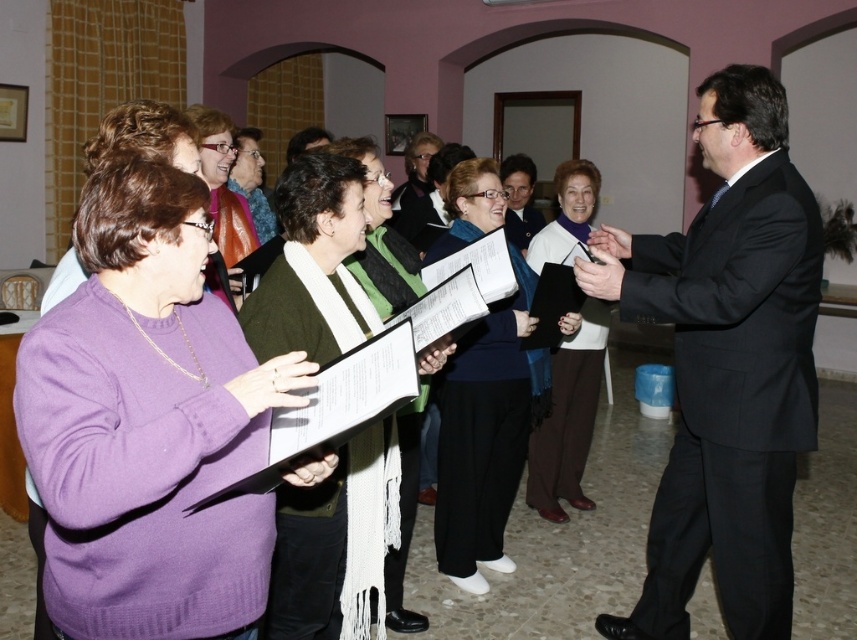
Question: From the image, what is the correct spatial relationship of blue fabric scarf at center in relation to matte green scarf at center?

Choices:
 (A) above
 (B) below

Answer: (B)

Question: Is black suit at right to the right of blue fabric scarf at center from the viewer's perspective?

Choices:
 (A) yes
 (B) no

Answer: (A)

Question: Which point appears closest to the camera in this image?

Choices:
 (A) coord(232,136)
 (B) coord(126,516)

Answer: (B)

Question: Does blue fabric scarf at center come in front of white matte scarf at center?

Choices:
 (A) no
 (B) yes

Answer: (B)

Question: Which of the following is the farthest from the observer?

Choices:
 (A) (250, 154)
 (B) (483, 504)
 (C) (588, 182)

Answer: (A)

Question: Which of the following is the closest to the observer?

Choices:
 (A) [470, 435]
 (B) [255, 184]

Answer: (A)